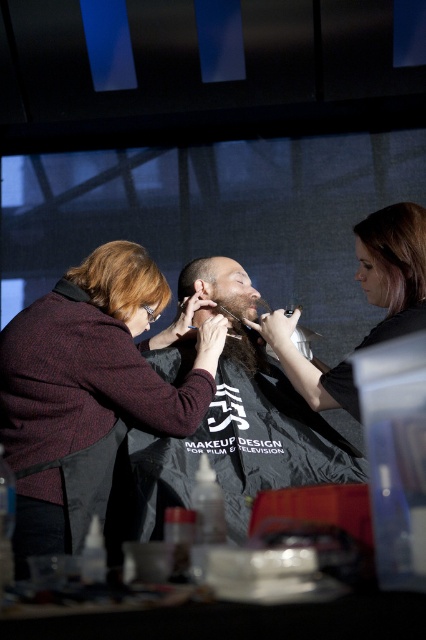
Is blonde smooth hair at upper right to the right of blonde hair at left from the viewer's perspective?

Correct, you'll find blonde smooth hair at upper right to the right of blonde hair at left.

This screenshot has height=640, width=426. Describe the element at coordinates (394, 253) in the screenshot. I see `blonde smooth hair at upper right` at that location.

Describe the element at coordinates (394, 253) in the screenshot. Image resolution: width=426 pixels, height=640 pixels. I see `blonde smooth hair at upper right` at that location.

Identify the location of blonde smooth hair at upper right. (394, 253).

Does dark gray fabric at center lie in front of blonde hair at left?

Yes, it is.

Can you confirm if dark gray fabric at center is positioned to the right of blonde hair at left?

Yes, dark gray fabric at center is to the right of blonde hair at left.

Is point (245, 332) positioned before point (118, 314)?

That is False.

This screenshot has width=426, height=640. In order to click on dark gray fabric at center in this screenshot , I will do `click(238, 444)`.

Does maroon woolen sweater at upper left appear on the left side of matte black hair at center?

Indeed, maroon woolen sweater at upper left is positioned on the left side of matte black hair at center.

Who is more distant from viewer, (207, 396) or (201, 273)?

The point (201, 273) is more distant.

Is point (144, 262) positioned in front of point (181, 273)?

Yes, it is in front of point (181, 273).

Identify the location of maroon woolen sweater at upper left. (91, 381).